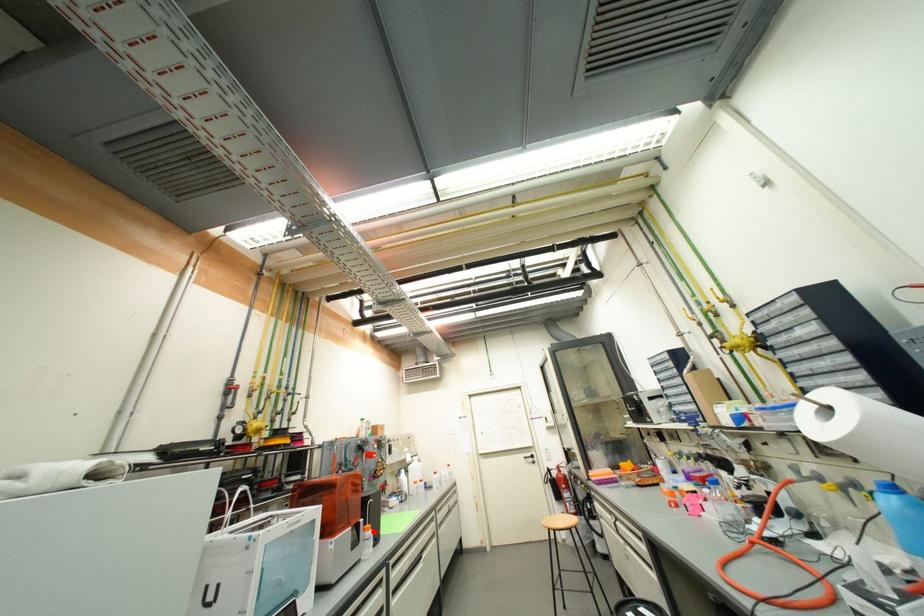
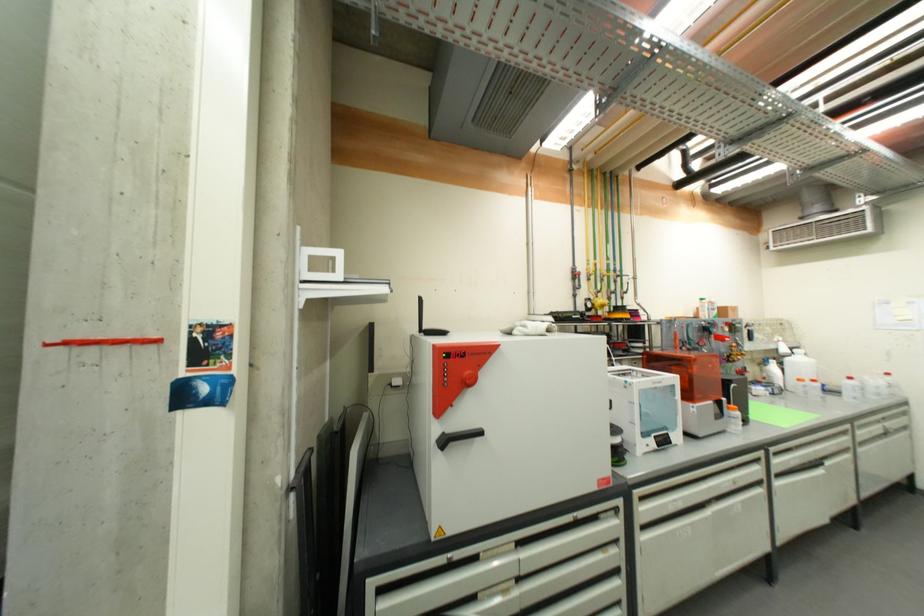
Where in the second image is the point corresponding to the highlighted location from the first image?

(739, 411)